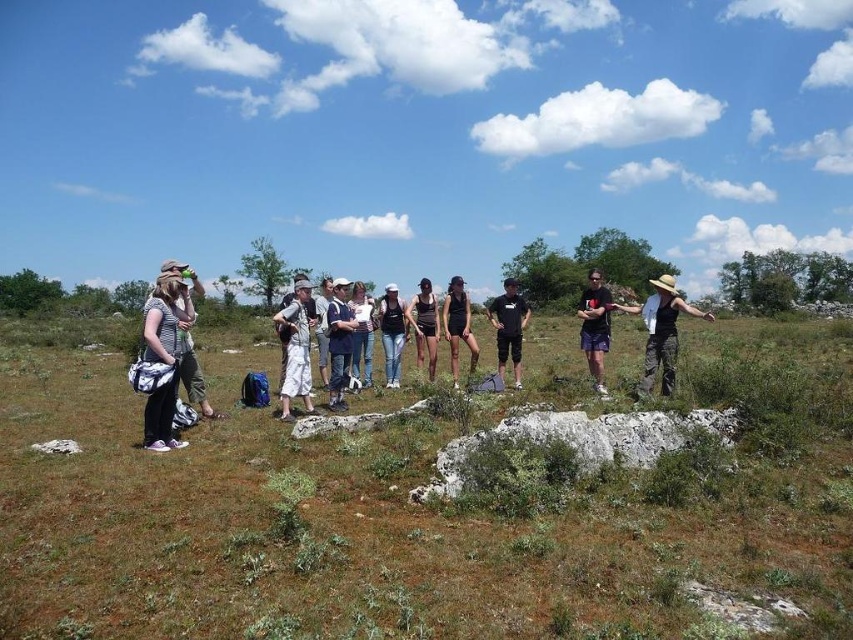
Looking at this image, can you confirm if green grassy field at center is positioned to the left of striped fabric backpack at left?

Incorrect, green grassy field at center is not on the left side of striped fabric backpack at left.

Between point (67, 410) and point (173, 332), which one is positioned in front?

Point (173, 332) is more forward.

Between point (845, 420) and point (167, 396), which one is positioned behind?

Positioned behind is point (845, 420).

The width and height of the screenshot is (853, 640). In order to click on green grassy field at center in this screenshot , I will do `click(409, 516)`.

Can you confirm if striped fabric backpack at left is taller than denim jeans at center?

Yes, striped fabric backpack at left is taller than denim jeans at center.

The image size is (853, 640). Identify the location of striped fabric backpack at left. pyautogui.click(x=163, y=356).

Between black matte shirt at center and black matte dress at center, which one appears on the right side from the viewer's perspective?

From the viewer's perspective, black matte shirt at center appears more on the right side.

Who is more forward, (x=520, y=296) or (x=442, y=305)?

Point (x=442, y=305) is in front.

At what (x,y) coordinates should I click in order to perform the action: click on black matte shirt at center. Please return your answer as a coordinate pair (x, y). This screenshot has width=853, height=640. Looking at the image, I should click on (509, 326).